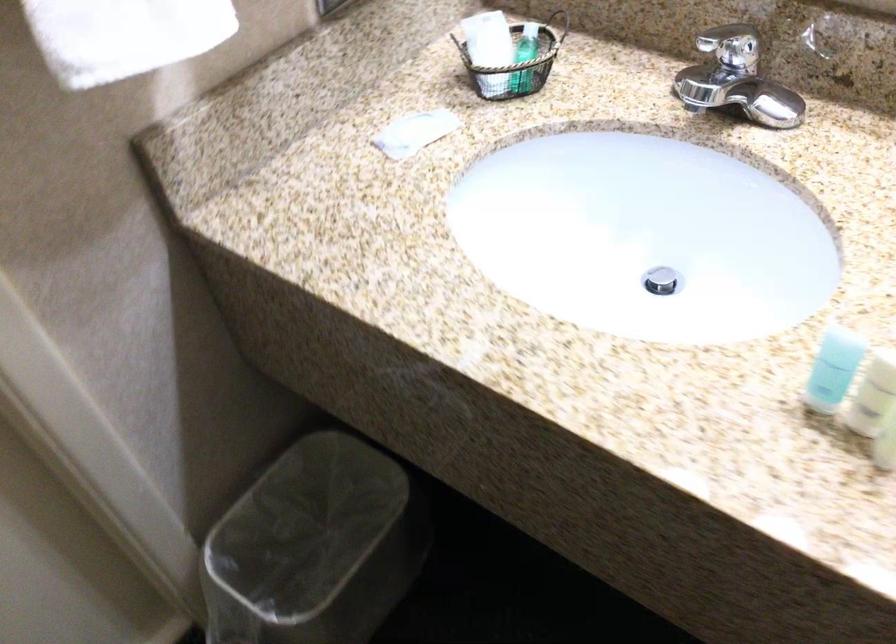
Describe the element at coordinates (524, 59) in the screenshot. The height and width of the screenshot is (644, 896). I see `a small green bottle` at that location.